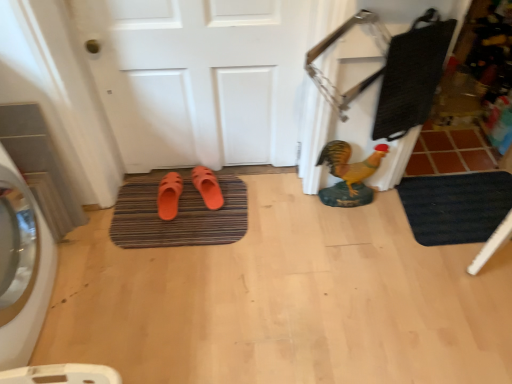
The height and width of the screenshot is (384, 512). What are the coordinates of `vacant space underneath yellow matte chicken at center-right (from a real-world perspective)` in the screenshot? It's located at (346, 202).